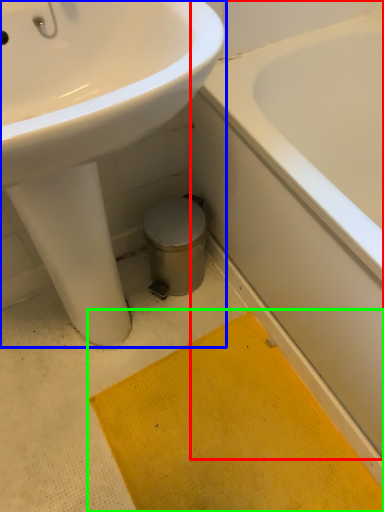
Question: Which object is positioned farthest from bathtub (highlighted by a red box)? Select from sink (highlighted by a blue box) and bath mat (highlighted by a green box).

Choices:
 (A) sink
 (B) bath mat

Answer: (A)